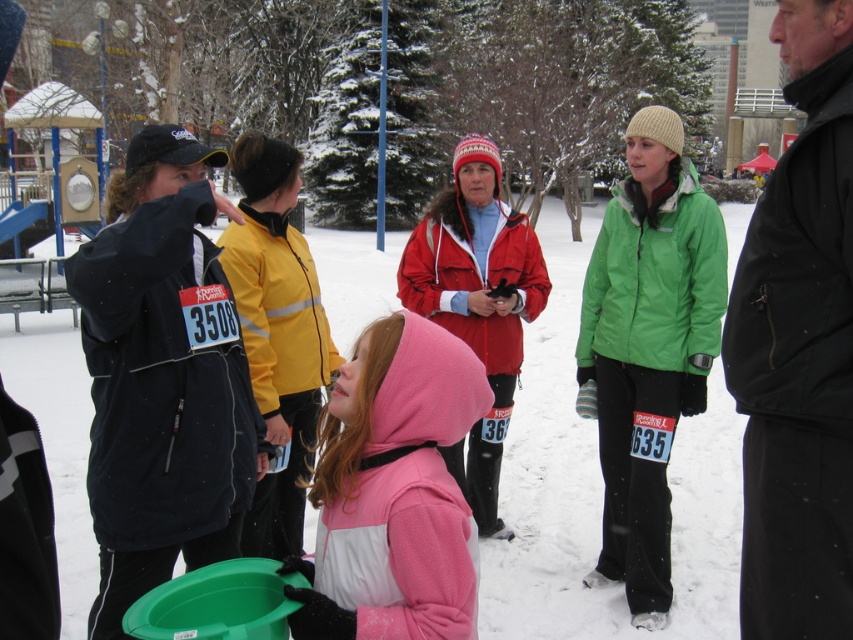
Which of these two, green matte jacket at center or pink fleece jacket at center, stands taller?

Standing taller between the two is green matte jacket at center.

Can you confirm if green matte jacket at center is positioned below pink fleece jacket at center?

No.

Is point (672, 410) positioned behind point (410, 624)?

Yes, point (672, 410) is farther from viewer.

Where is `green matte jacket at center`? green matte jacket at center is located at coordinates (647, 349).

Is pink fleece jacket at center to the left of matte red jacket at center from the viewer's perspective?

Correct, you'll find pink fleece jacket at center to the left of matte red jacket at center.

Between point (405, 372) and point (467, 502), which one is positioned behind?

The point (467, 502) is more distant.

The width and height of the screenshot is (853, 640). I want to click on pink fleece jacket at center, so click(x=393, y=493).

This screenshot has height=640, width=853. What do you see at coordinates (799, 348) in the screenshot?
I see `black matte jacket at center` at bounding box center [799, 348].

Is black matte jacket at center to the left of pink fleece jacket at center from the viewer's perspective?

No, black matte jacket at center is not to the left of pink fleece jacket at center.

Who is more forward, (842, 499) or (378, 496)?

Positioned in front is point (378, 496).

Where is `black matte jacket at center`? The width and height of the screenshot is (853, 640). black matte jacket at center is located at coordinates (799, 348).